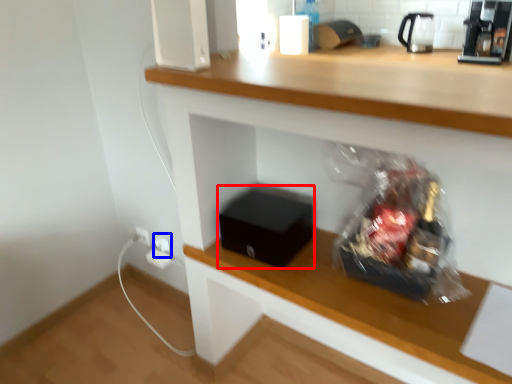
Question: Which object is further to the camera taking this photo, box (highlighted by a red box) or electric outlet (highlighted by a blue box)?

Choices:
 (A) box
 (B) electric outlet

Answer: (B)